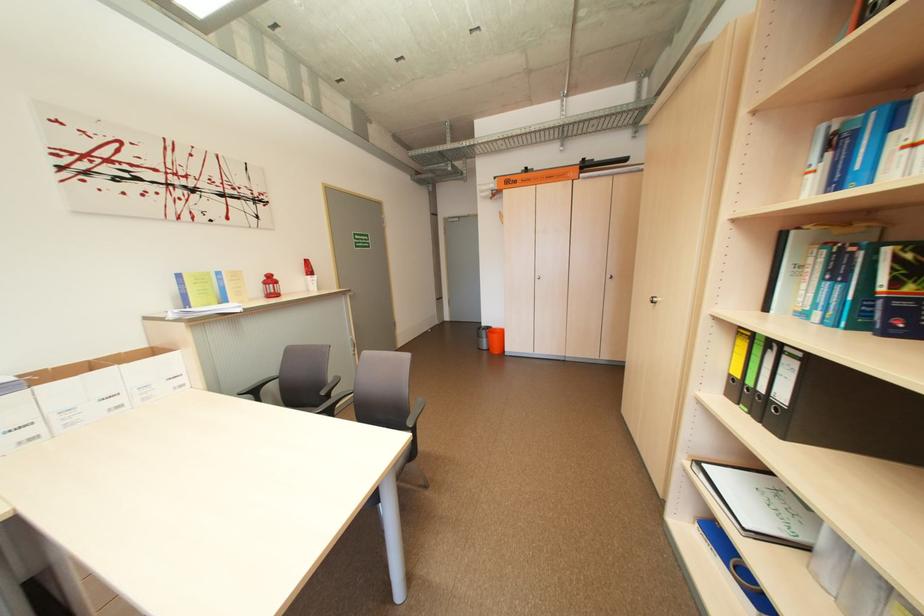
At what (x,y) coordinates should I click in order to perform the action: click on lever door handle. Please return your answer as a coordinate pair (x, y). The height and width of the screenshot is (616, 924). Looking at the image, I should click on (653, 300).